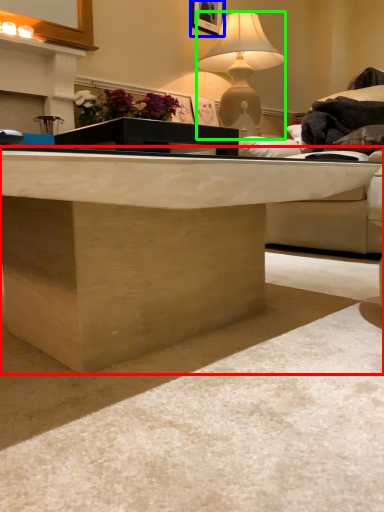
Question: Which object is positioned farthest from desk (highlighted by a red box)? Select from picture frame (highlighted by a blue box) and lamp (highlighted by a green box).

Choices:
 (A) picture frame
 (B) lamp

Answer: (A)